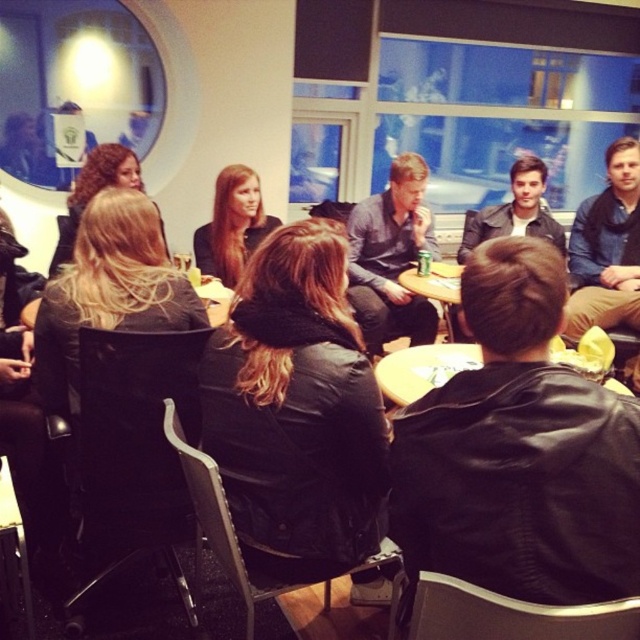
Based on the photo, which of these two, black leather jacket at center or black leather jacket at left, stands taller?

black leather jacket at center

Can you confirm if black leather jacket at center is thinner than black leather jacket at left?

Indeed, black leather jacket at center has a lesser width compared to black leather jacket at left.

Who is more forward, (260, 529) or (58, 301)?

Point (260, 529)

Locate an element on the screen. black leather jacket at center is located at coordinates (296, 410).

Which is below, leather jacket at center or blonde hair at center?

Positioned lower is leather jacket at center.

Between leather jacket at center and blonde hair at center, which one has more height?

Standing taller between the two is blonde hair at center.

Is point (520, 232) positioned after point (104, 161)?

Yes, it is behind point (104, 161).

This screenshot has width=640, height=640. What are the coordinates of `leather jacket at center` in the screenshot? It's located at [x=515, y=211].

Locate an element on the screen. The image size is (640, 640). black leather jacket at left is located at coordinates (108, 291).

You are a GUI agent. You are given a task and a screenshot of the screen. Output one action in this format:
    pyautogui.click(x=<x>, y=<y>)
    Task: Click on the black leather jacket at left
    This screenshot has height=640, width=640.
    Given the screenshot: What is the action you would take?
    pyautogui.click(x=108, y=291)